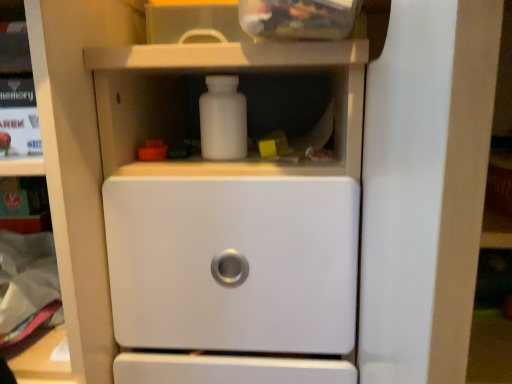
Where is `white matte bottle at center`? The height and width of the screenshot is (384, 512). white matte bottle at center is located at coordinates (223, 119).

The height and width of the screenshot is (384, 512). What do you see at coordinates (223, 119) in the screenshot?
I see `white matte bottle at center` at bounding box center [223, 119].

What are the coordinates of `white matte bottle at center` in the screenshot? It's located at (223, 119).